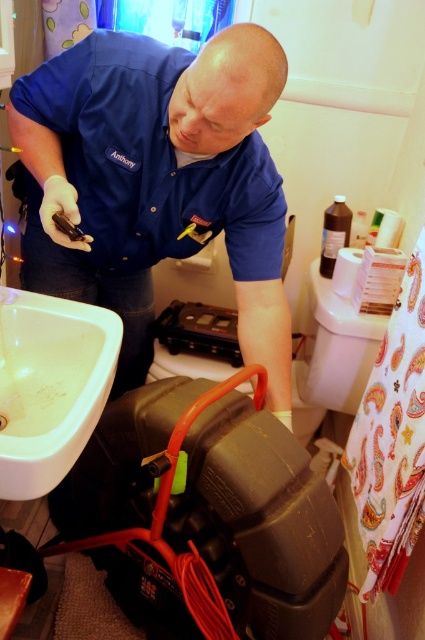
Between blue uniform shirt at upper center and white glossy sink at lower left, which one has more height?

blue uniform shirt at upper center is taller.

Who is more forward, (36, 108) or (30, 458)?

Point (30, 458) is in front.

Is point (260, 298) positioned in front of point (8, 336)?

No, (260, 298) is behind (8, 336).

This screenshot has width=425, height=640. What are the coordinates of `blue uniform shirt at upper center` in the screenshot? It's located at (158, 180).